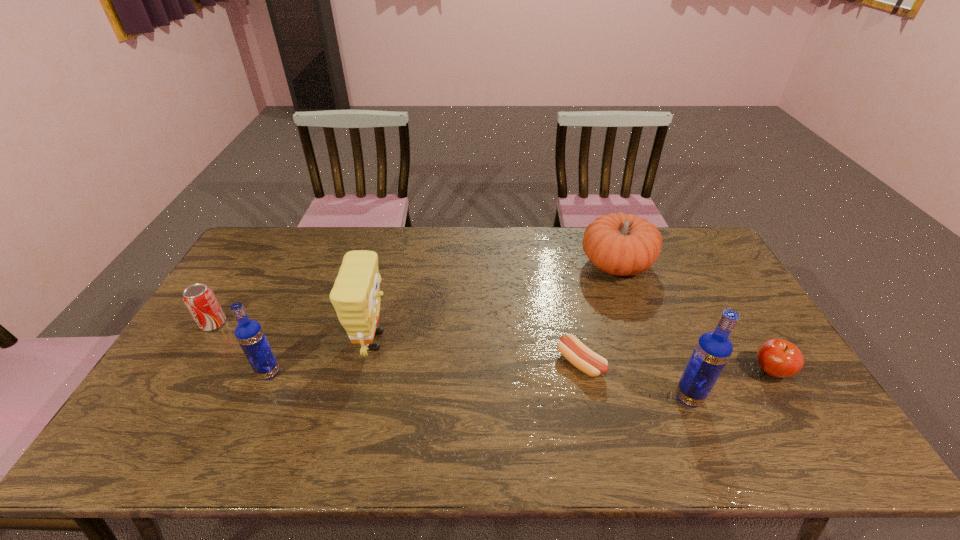
Where is `object positioned at the far edge`? The width and height of the screenshot is (960, 540). object positioned at the far edge is located at coordinates (620, 244).

At what (x,y) coordinates should I click in order to perform the action: click on object located at the near edge. Please return your answer as a coordinate pair (x, y). This screenshot has width=960, height=540. Looking at the image, I should click on (713, 349).

The height and width of the screenshot is (540, 960). Find the location of `object that is at the left edge`. object that is at the left edge is located at coordinates (200, 300).

The height and width of the screenshot is (540, 960). In order to click on object at the right edge in this screenshot , I will do 779,358.

The width and height of the screenshot is (960, 540). In the image, there is a desktop. Find the location of `blank space at the far edge`. blank space at the far edge is located at coordinates (468, 240).

Identify the location of blank space at the near edge of the desktop. This screenshot has width=960, height=540. (588, 404).

Find the location of a particular element. This screenshot has width=960, height=540. free space at the left edge of the desktop is located at coordinates (254, 300).

Where is `free space at the right edge`? This screenshot has height=540, width=960. free space at the right edge is located at coordinates (742, 363).

Where is `vacant space at the far left corner`? This screenshot has height=540, width=960. vacant space at the far left corner is located at coordinates (280, 232).

This screenshot has height=540, width=960. In the image, there is a desktop. What are the coordinates of `vacant space at the near left corner` in the screenshot? It's located at (161, 407).